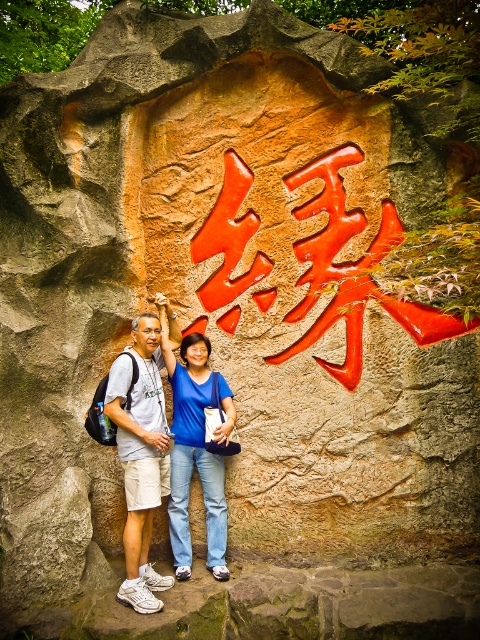
You are standing at the point marked by the coordinates (x=142, y=451) in the scene. What object are you standing on?

You are standing on the white athletic shoes at left.